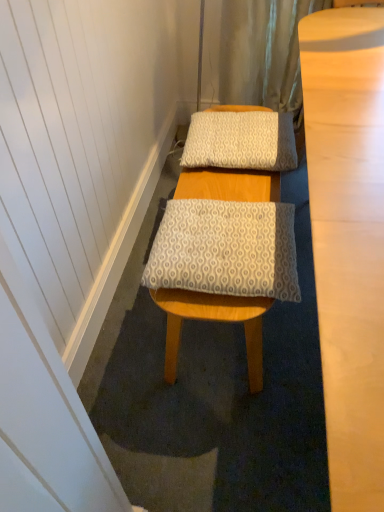
Question: Is patterned fabric pillow at center, the second pillow positioned from the top, not near white textured bath mat at center?

Choices:
 (A) no
 (B) yes

Answer: (A)

Question: Is patterned fabric pillow at center, the second pillow positioned from the top, smaller than white textured bath mat at center?

Choices:
 (A) yes
 (B) no

Answer: (A)

Question: Can you confirm if patterned fabric pillow at center, acting as the second pillow starting from the back, is thinner than white textured bath mat at center?

Choices:
 (A) yes
 (B) no

Answer: (A)

Question: From the image's perspective, does patterned fabric pillow at center, acting as the second pillow starting from the back, appear higher than white textured bath mat at center?

Choices:
 (A) no
 (B) yes

Answer: (A)

Question: From a real-world perspective, is patterned fabric pillow at center, the first pillow when ordered from front to back, positioned under white textured bath mat at center based on gravity?

Choices:
 (A) yes
 (B) no

Answer: (B)

Question: In terms of width, does white textured pillow at center, acting as the 2th pillow starting from the front, look wider or thinner when compared to white textured bath mat at center?

Choices:
 (A) wide
 (B) thin

Answer: (B)

Question: Is white textured pillow at center, acting as the 2th pillow starting from the front, bigger or smaller than white textured bath mat at center?

Choices:
 (A) small
 (B) big

Answer: (A)

Question: From their relative heights in the image, would you say white textured pillow at center, which is the 2th pillow from bottom to top, is taller or shorter than white textured bath mat at center?

Choices:
 (A) tall
 (B) short

Answer: (A)

Question: Does point (190, 137) appear closer or farther from the camera than point (309, 251)?

Choices:
 (A) closer
 (B) farther

Answer: (B)

Question: In terms of width, does patterned fabric pillow at center, the second pillow positioned from the top, look wider or thinner when compared to white textured bath mat at center?

Choices:
 (A) wide
 (B) thin

Answer: (B)

Question: From a real-world perspective, is patterned fabric pillow at center, acting as the second pillow starting from the back, positioned above or below white textured bath mat at center?

Choices:
 (A) above
 (B) below

Answer: (A)

Question: Considering the positions of patterned fabric pillow at center, acting as the second pillow starting from the back, and white textured bath mat at center in the image, is patterned fabric pillow at center, acting as the second pillow starting from the back, bigger or smaller than white textured bath mat at center?

Choices:
 (A) big
 (B) small

Answer: (B)

Question: From the image's perspective, relative to white textured bath mat at center, is patterned fabric pillow at center, the second pillow positioned from the top, above or below?

Choices:
 (A) below
 (B) above

Answer: (A)

Question: Looking at the image, does patterned fabric pillow at center, the first pillow when ordered from front to back, seem bigger or smaller compared to white textured pillow at center, which is the 1th pillow from back to front?

Choices:
 (A) big
 (B) small

Answer: (B)

Question: Considering their positions, is patterned fabric pillow at center, marked as the 1th pillow in a bottom-to-top arrangement, located in front of or behind white textured pillow at center, the first pillow in the top-to-bottom sequence?

Choices:
 (A) behind
 (B) front

Answer: (B)